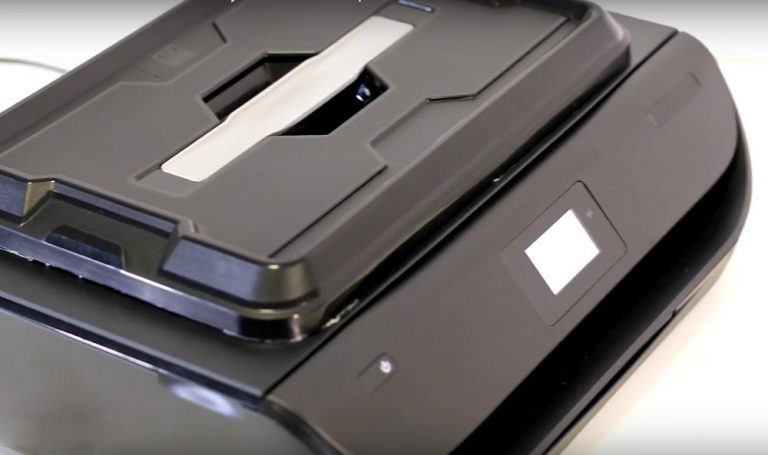
Where is `white surface`? white surface is located at coordinates click(x=694, y=412).